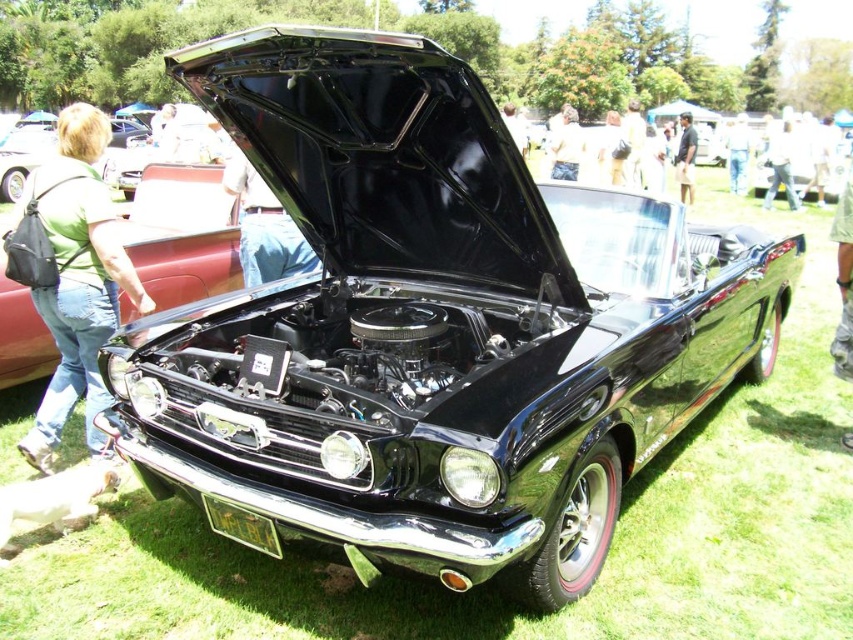
Who is more forward, (131, 288) or (294, 243)?

Point (131, 288)

Between point (82, 128) and point (306, 253), which one is positioned in front?

Point (82, 128)

In order to click on green fabric backpack at left in this screenshot , I will do `click(73, 276)`.

Which is behind, point (254, 230) or point (775, 164)?

Point (775, 164)

Is point (252, 211) behind point (776, 164)?

No, (252, 211) is closer to viewer.

This screenshot has height=640, width=853. Describe the element at coordinates (263, 227) in the screenshot. I see `blue denim jeans at center` at that location.

Where is `blue denim jeans at center`? Image resolution: width=853 pixels, height=640 pixels. blue denim jeans at center is located at coordinates [x=263, y=227].

I want to click on blue denim jeans at center, so click(x=263, y=227).

Can you confirm if blue denim jeans at center is wider than jeans at center?

Incorrect, blue denim jeans at center's width does not surpass jeans at center's.

Where is `blue denim jeans at center`? This screenshot has width=853, height=640. blue denim jeans at center is located at coordinates (263, 227).